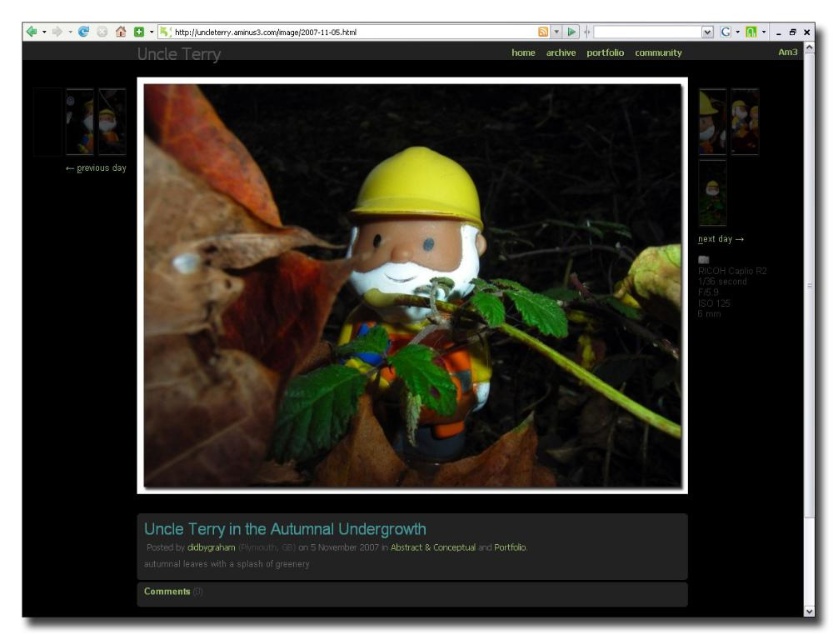
Based on the scene described, can you determine if the green leafy plant at center is wider than the yellow matte plastic doll at center?

The green leafy plant at center might be wider than the yellow matte plastic doll at center according to the description provided.